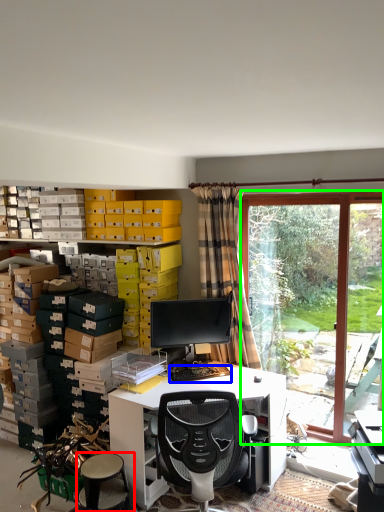
Question: Based on their relative distances, which object is nearer to stool (highlighted by a red box)? Choose from computer keyboard (highlighted by a blue box) and bay window (highlighted by a green box).

Choices:
 (A) computer keyboard
 (B) bay window

Answer: (A)